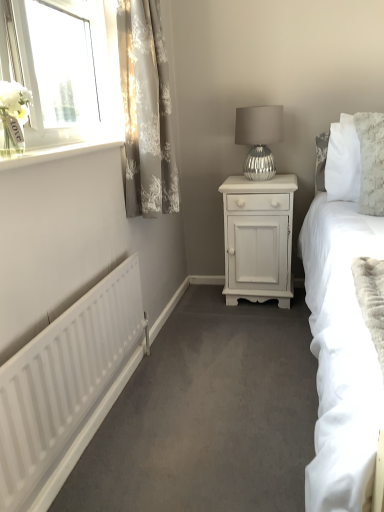
Question: From the image's perspective, is gray floral fabric curtain at upper left positioned above or below white painted wood nightstand at center?

Choices:
 (A) below
 (B) above

Answer: (B)

Question: Is gray floral fabric curtain at upper left bigger or smaller than white painted wood nightstand at center?

Choices:
 (A) big
 (B) small

Answer: (B)

Question: Estimate the real-world distances between objects in this image. Which object is closer to the silver textured lamp at center?

Choices:
 (A) white matte radiator at lower left
 (B) gray floral fabric curtain at upper left
 (C) white painted wood at upper left
 (D) white painted wood nightstand at center

Answer: (D)

Question: Which of these objects is positioned farthest from the white painted wood nightstand at center?

Choices:
 (A) gray floral fabric curtain at upper left
 (B) white painted wood at upper left
 (C) silver textured lamp at center
 (D) white matte radiator at lower left

Answer: (D)